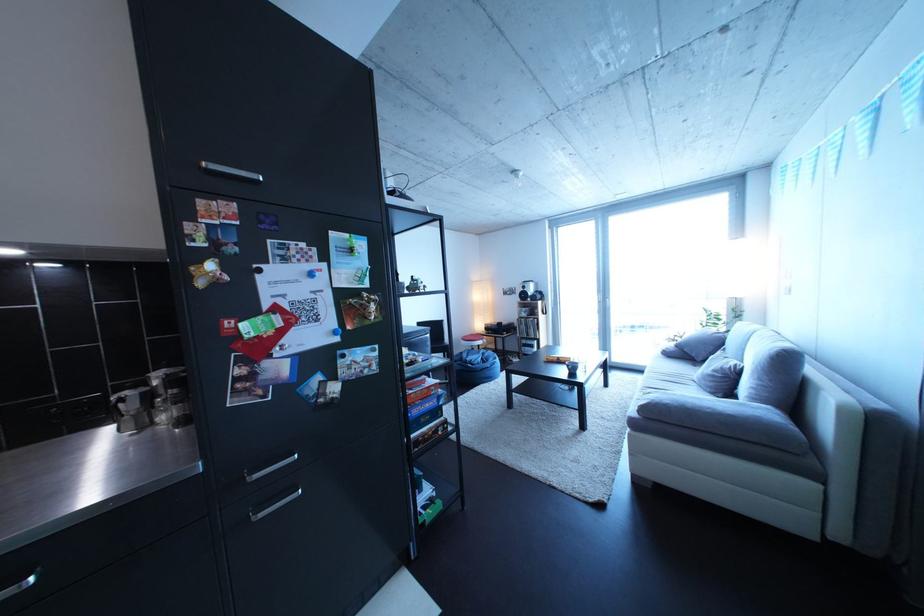
Which object does [131,408] point to?

It refers to a metal moka pot.